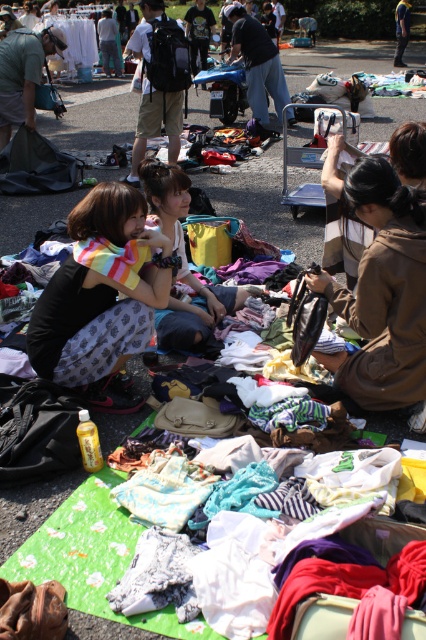
Is point (423, 301) closer to camera compared to point (42, 369)?

Yes.

Does brown suede jacket at center have a greater height compared to printed cotton skirt at center?

Correct, brown suede jacket at center is much taller as printed cotton skirt at center.

Find the location of `brown suede jacket at center`. brown suede jacket at center is located at coordinates (382, 292).

The height and width of the screenshot is (640, 426). Identify the location of brown suede jacket at center. (382, 292).

Does matte black backpack at center have a greater width compared to white cotton shirt at upper left?

No.

Identify the location of matte black backpack at center. (161, 74).

The image size is (426, 640). In order to click on matte black backpack at center in this screenshot , I will do `click(161, 74)`.

Which is above, matte black t-shirt at center or denim jacket at upper right?

denim jacket at upper right

Does point (195, 70) lie behind point (403, 32)?

No, it is in front of (403, 32).

This screenshot has height=640, width=426. In order to click on matte black t-shirt at center in this screenshot , I will do `click(198, 32)`.